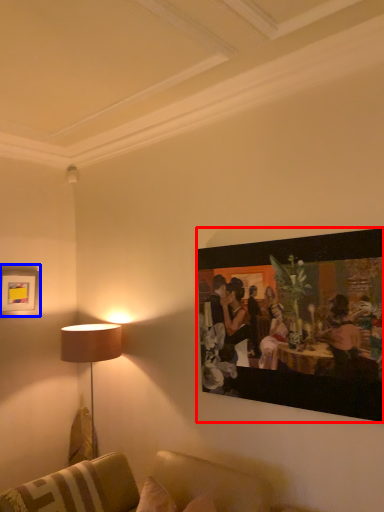
Question: Which point is closer to the camera, picture frame (highlighted by a red box) or picture frame (highlighted by a blue box)?

Choices:
 (A) picture frame
 (B) picture frame

Answer: (A)